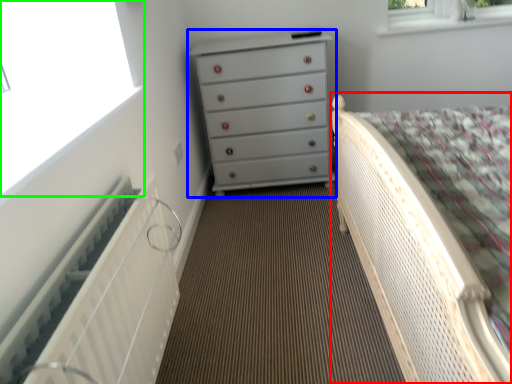
Question: Estimate the real-world distances between objects in this image. Which object is closer to bed (highlighted by a red box), chest of drawers (highlighted by a blue box) or window (highlighted by a green box)?

Choices:
 (A) chest of drawers
 (B) window

Answer: (B)